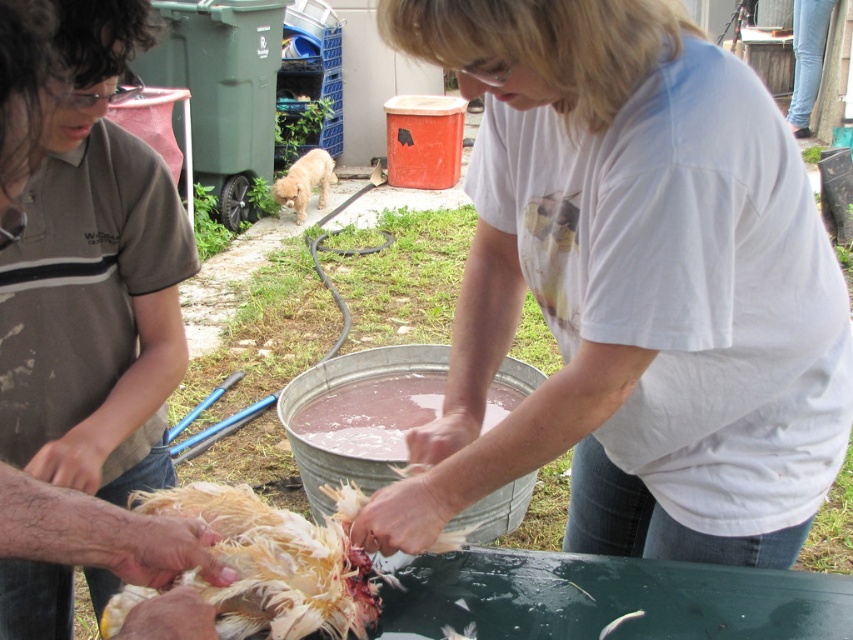
Measure the distance between white cotton shirt at center and pink translucent liquid at center.

white cotton shirt at center is 3.50 feet away from pink translucent liquid at center.

Can you confirm if white cotton shirt at center is positioned to the right of pink translucent liquid at center?

Indeed, white cotton shirt at center is positioned on the right side of pink translucent liquid at center.

You are a GUI agent. You are given a task and a screenshot of the screen. Output one action in this format:
    pyautogui.click(x=<x>, y=<y>)
    Task: Click on the white cotton shirt at center
    Image resolution: width=853 pixels, height=640 pixels.
    Given the screenshot: What is the action you would take?
    pyautogui.click(x=631, y=288)

Does white cotton shirt at center have a greater width compared to light brown fur dog at center?

Correct, the width of white cotton shirt at center exceeds that of light brown fur dog at center.

Can you confirm if white cotton shirt at center is smaller than light brown fur dog at center?

Incorrect, white cotton shirt at center is not smaller in size than light brown fur dog at center.

Does point (601, 38) come behind point (321, 180)?

That is False.

Identify the location of white cotton shirt at center. (631, 288).

Is brown cotton shirt at upper left in front of pink translucent liquid at center?

Yes, it is.

Can you confirm if brown cotton shirt at upper left is positioned to the right of pink translucent liquid at center?

Incorrect, brown cotton shirt at upper left is not on the right side of pink translucent liquid at center.

Between point (167, 268) and point (373, 419), which one is positioned behind?

The point (373, 419) is more distant.

The height and width of the screenshot is (640, 853). What are the coordinates of `brown cotton shirt at upper left` in the screenshot? It's located at 94,280.